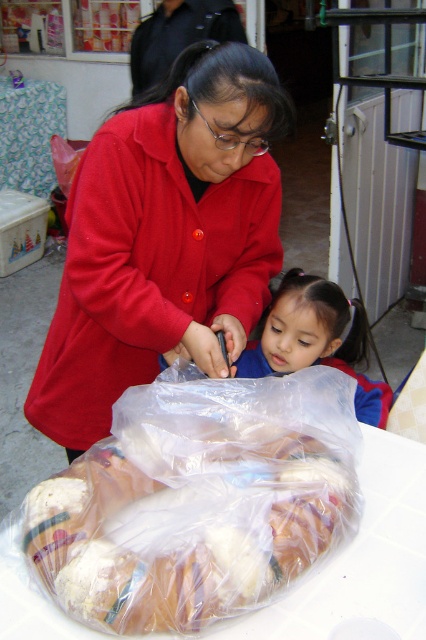
Question: Is the position of translucent plastic bag at center less distant than that of blue fabric jacket at center?

Choices:
 (A) no
 (B) yes

Answer: (B)

Question: Is translucent plastic bag at center wider than matte red coat at center?

Choices:
 (A) yes
 (B) no

Answer: (B)

Question: Is translucent plastic bag at center above matte red coat at center?

Choices:
 (A) yes
 (B) no

Answer: (B)

Question: Among these objects, which one is farthest from the camera?

Choices:
 (A) matte red coat at center
 (B) translucent plastic bag at center
 (C) blue fabric jacket at center

Answer: (C)

Question: Estimate the real-world distances between objects in this image. Which object is closer to the blue fabric jacket at center?

Choices:
 (A) matte red coat at center
 (B) translucent plastic bag at center

Answer: (A)

Question: Among these points, which one is nearest to the camera?

Choices:
 (A) (161, 456)
 (B) (276, 358)

Answer: (A)